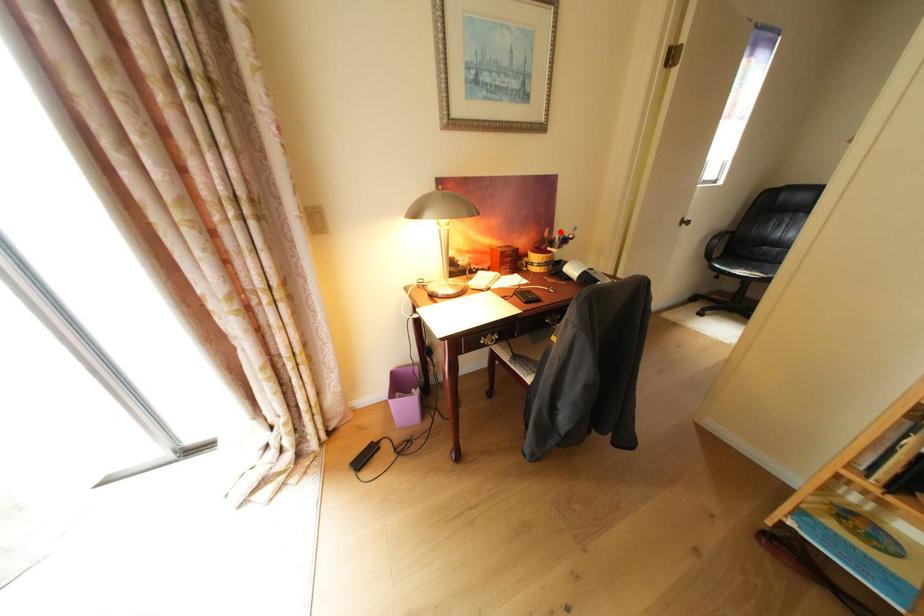
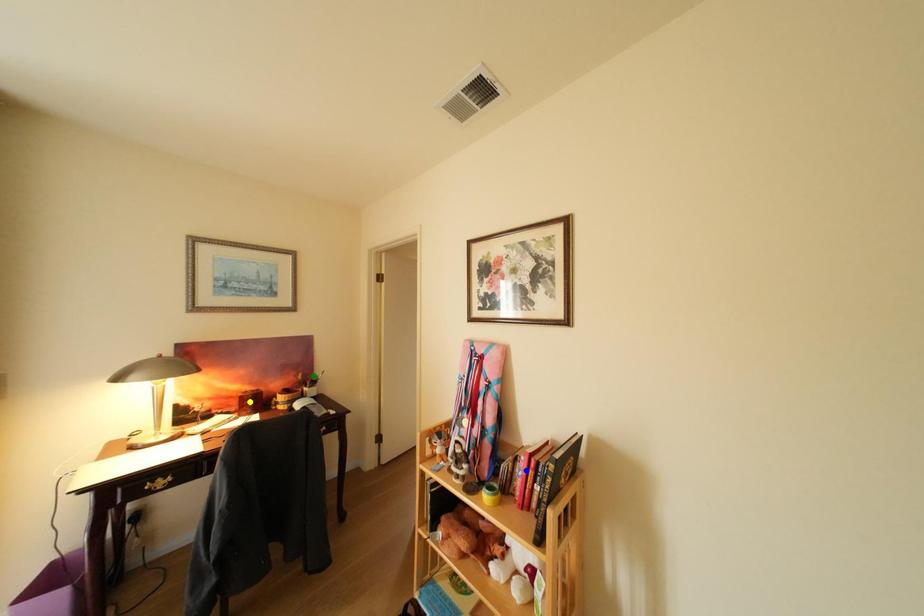
Question: I am providing you with two images of the same scene from different viewpoints. A red point is marked on the first image. You are given multiple points on the second image. Which mark in image 2 goes with the point in image 1?

Choices:
 (A) yellow point
 (B) blue point
 (C) green point

Answer: (C)